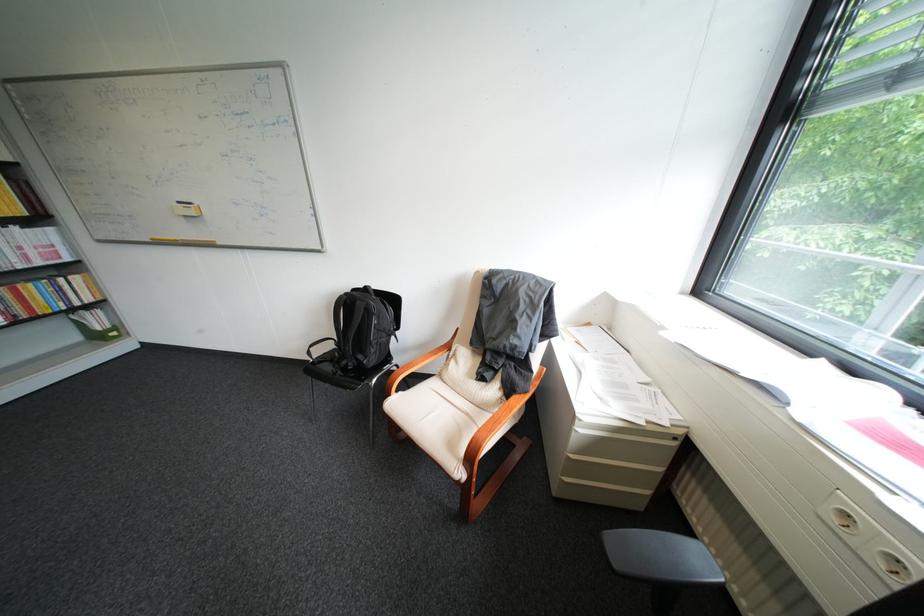
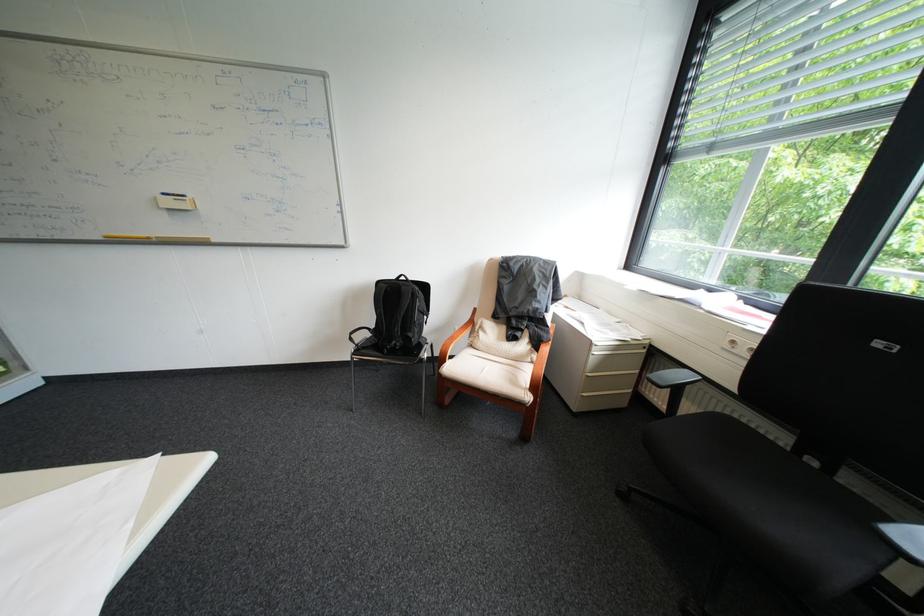
Locate, in the second image, the point that corresponds to [592,431] in the first image.

(609, 353)